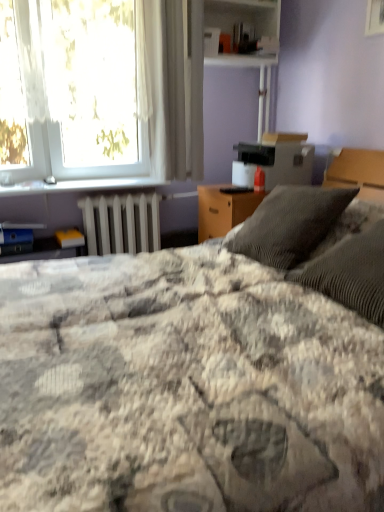
Question: Is white sheer curtain at upper center not near metallic silver window sill at upper left?

Choices:
 (A) no
 (B) yes

Answer: (A)

Question: Is white sheer curtain at upper center at the right side of metallic silver window sill at upper left?

Choices:
 (A) yes
 (B) no

Answer: (A)

Question: Is white sheer curtain at upper center further to the viewer compared to metallic silver window sill at upper left?

Choices:
 (A) no
 (B) yes

Answer: (A)

Question: Considering the relative positions of white sheer curtain at upper center and metallic silver window sill at upper left in the image provided, is white sheer curtain at upper center in front of metallic silver window sill at upper left?

Choices:
 (A) no
 (B) yes

Answer: (B)

Question: Is the surface of white sheer curtain at upper center in direct contact with metallic silver window sill at upper left?

Choices:
 (A) yes
 (B) no

Answer: (B)

Question: Is white plastic shelf at upper center to the left or to the right of metallic silver window sill at upper left in the image?

Choices:
 (A) right
 (B) left

Answer: (A)

Question: Considering the positions of white plastic shelf at upper center and metallic silver window sill at upper left in the image, is white plastic shelf at upper center wider or thinner than metallic silver window sill at upper left?

Choices:
 (A) wide
 (B) thin

Answer: (A)

Question: From the image's perspective, is white plastic shelf at upper center located above or below metallic silver window sill at upper left?

Choices:
 (A) below
 (B) above

Answer: (B)

Question: Does point (226, 56) appear closer or farther from the camera than point (105, 179)?

Choices:
 (A) farther
 (B) closer

Answer: (B)

Question: Relative to fluffy gray blanket at center, is white sheer curtain at upper center in front or behind?

Choices:
 (A) front
 (B) behind

Answer: (B)

Question: Considering the positions of white sheer curtain at upper center and fluffy gray blanket at center in the image, is white sheer curtain at upper center wider or thinner than fluffy gray blanket at center?

Choices:
 (A) wide
 (B) thin

Answer: (B)

Question: In terms of height, does white sheer curtain at upper center look taller or shorter compared to fluffy gray blanket at center?

Choices:
 (A) short
 (B) tall

Answer: (B)

Question: Considering the relative positions of white sheer curtain at upper center and fluffy gray blanket at center in the image provided, is white sheer curtain at upper center to the left or to the right of fluffy gray blanket at center?

Choices:
 (A) left
 (B) right

Answer: (A)

Question: Is point (183, 146) closer or farther from the camera than point (99, 178)?

Choices:
 (A) closer
 (B) farther

Answer: (A)

Question: Considering the positions of white sheer curtain at upper center and metallic silver window sill at upper left in the image, is white sheer curtain at upper center wider or thinner than metallic silver window sill at upper left?

Choices:
 (A) thin
 (B) wide

Answer: (A)